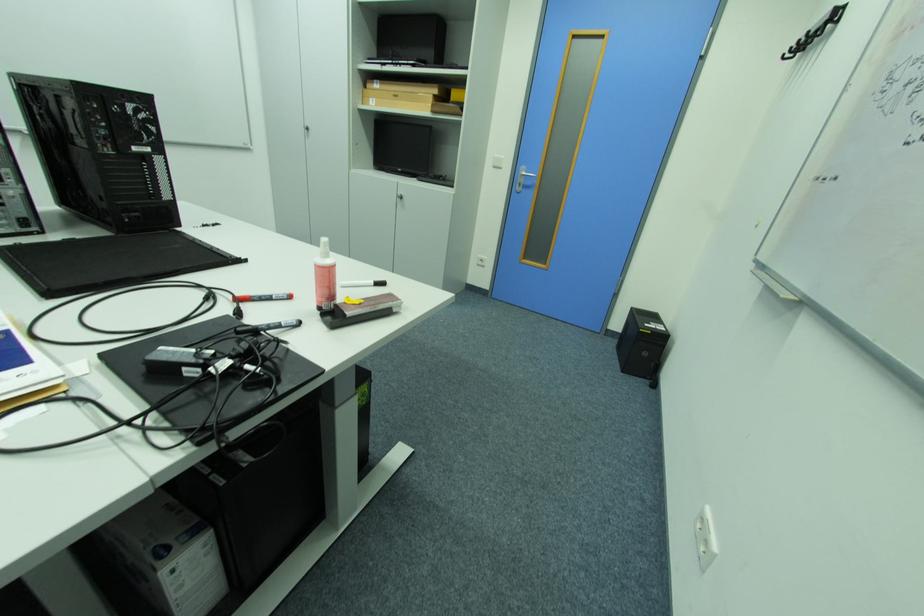
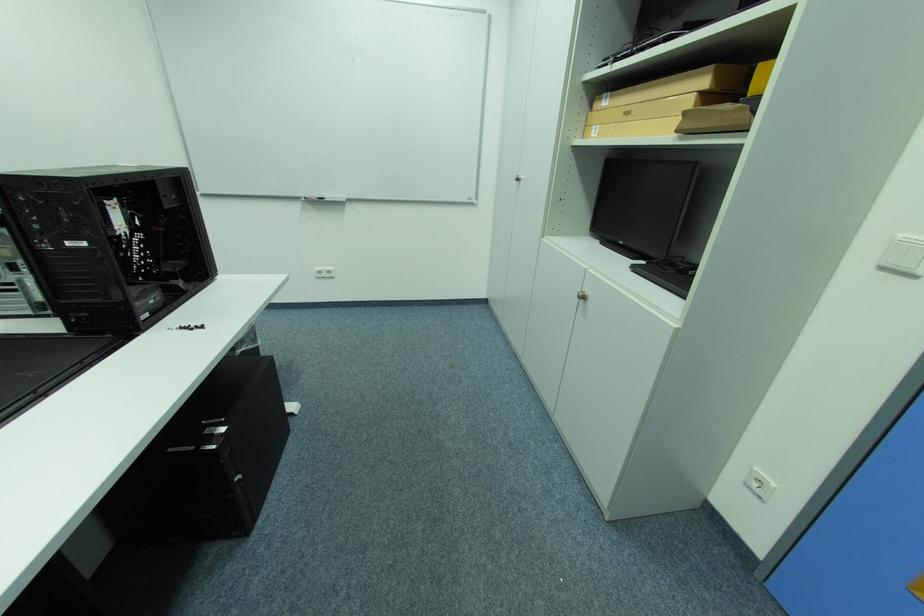
In the second image, find the point that corresponds to point (385, 84) in the first image.

(614, 98)